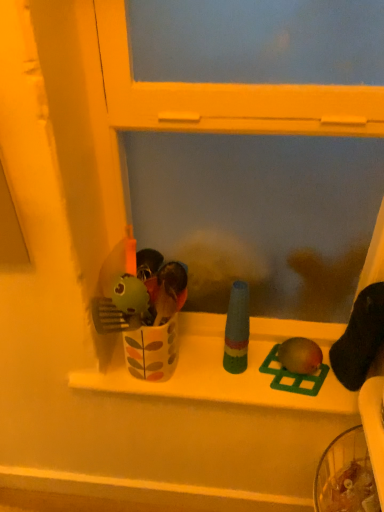
Locate an element on the screen. The image size is (384, 512). multicolored plastic bottle at center, the first toy from the left is located at coordinates (237, 329).

Where is `matte green toy at center, which ranks as the 3th toy in left-to-right order`? matte green toy at center, which ranks as the 3th toy in left-to-right order is located at coordinates (300, 356).

The image size is (384, 512). I want to click on green plastic bird at center, which is counted as the 2th toy, starting from the right, so click(292, 376).

Measure the distance between point (305, 384) and camera.

3.28 feet.

Image resolution: width=384 pixels, height=512 pixels. Find the location of `multicolored plastic bottle at center, the 3th toy when ordered from right to left`. multicolored plastic bottle at center, the 3th toy when ordered from right to left is located at coordinates (237, 329).

From a real-world perspective, between green plastic bird at center, which is counted as the 2th toy, starting from the right, and multicolored plastic bottle at center, the 3th toy when ordered from right to left, who is vertically lower?

green plastic bird at center, which is counted as the 2th toy, starting from the right.

Does point (300, 383) come closer to viewer compared to point (233, 304)?

No, (300, 383) is further to viewer.

From the image's perspective, starting from the multicolored plastic bottle at center, the first toy from the left, which toy is the 2nd one below? Please provide its 2D coordinates.

[(292, 376)]

Considering the sizes of objects green plastic bird at center, which is counted as the 2th toy, starting from the right, and multicolored plastic bottle at center, the first toy from the left, in the image provided, who is bigger, green plastic bird at center, which is counted as the 2th toy, starting from the right, or multicolored plastic bottle at center, the first toy from the left,?

With larger size is multicolored plastic bottle at center, the first toy from the left.

From the picture: From the image's perspective, is white glossy window sill at center over multicolored plastic bottle at center, the first toy from the left?

No, from the image's perspective, white glossy window sill at center is not on top of multicolored plastic bottle at center, the first toy from the left.

Is white glossy window sill at center wider than multicolored plastic bottle at center, the first toy from the left?

Yes, white glossy window sill at center is wider than multicolored plastic bottle at center, the first toy from the left.

Could you tell me if white glossy window sill at center is facing multicolored plastic bottle at center, the 3th toy when ordered from right to left?

No, white glossy window sill at center is not turned towards multicolored plastic bottle at center, the 3th toy when ordered from right to left.

Considering the points (187, 382) and (248, 325), which point is behind, point (187, 382) or point (248, 325)?

Point (248, 325)

Is green plastic bird at center, which is counted as the 2th toy, starting from the left, located within matte green toy at center, which is counted as the first toy, starting from the right?

No, green plastic bird at center, which is counted as the 2th toy, starting from the left, is located outside of matte green toy at center, which is counted as the first toy, starting from the right.

Measure the distance between matte green toy at center, which is counted as the first toy, starting from the right, and green plastic bird at center, which is counted as the 2th toy, starting from the left.

matte green toy at center, which is counted as the first toy, starting from the right, and green plastic bird at center, which is counted as the 2th toy, starting from the left, are 1.21 inches apart.

Between matte green toy at center, which ranks as the 3th toy in left-to-right order, and green plastic bird at center, which is counted as the 2th toy, starting from the right, which one has smaller size?

green plastic bird at center, which is counted as the 2th toy, starting from the right, is smaller.

Considering the relative positions of matte green toy at center, which is counted as the first toy, starting from the right, and green plastic bird at center, which is counted as the 2th toy, starting from the right, in the image provided, is matte green toy at center, which is counted as the first toy, starting from the right, to the right of green plastic bird at center, which is counted as the 2th toy, starting from the right, from the viewer's perspective?

Yes.

Find the location of a particular element. The width and height of the screenshot is (384, 512). the 1st toy positioned above the white glossy window sill at center (from a real-world perspective) is located at coordinates (292, 376).

Who is taller, white glossy window sill at center or green plastic bird at center, which is counted as the 2th toy, starting from the left?

Standing taller between the two is white glossy window sill at center.

Which is in front, point (188, 322) or point (270, 374)?

Point (270, 374)

Considering the sizes of objects white glossy window sill at center and green plastic bird at center, which is counted as the 2th toy, starting from the left, in the image provided, who is wider, white glossy window sill at center or green plastic bird at center, which is counted as the 2th toy, starting from the left,?

white glossy window sill at center is wider.

Does point (97, 387) appear closer or farther from the camera than point (302, 352)?

Point (97, 387).

Looking at this image, does white glossy window sill at center contain matte green toy at center, which is counted as the first toy, starting from the right?

Definitely not — matte green toy at center, which is counted as the first toy, starting from the right, is not inside white glossy window sill at center.

Is white glossy window sill at center oriented away from matte green toy at center, which is counted as the first toy, starting from the right?

No, white glossy window sill at center is not facing away from matte green toy at center, which is counted as the first toy, starting from the right.

Does point (234, 308) come behind point (298, 392)?

That is False.

Is multicolored plastic bottle at center, the first toy from the left, oriented towards green plastic bird at center, which is counted as the 2th toy, starting from the right?

No, multicolored plastic bottle at center, the first toy from the left, is not oriented towards green plastic bird at center, which is counted as the 2th toy, starting from the right.

Is green plastic bird at center, which is counted as the 2th toy, starting from the right, inside multicolored plastic bottle at center, the first toy from the left?

No, green plastic bird at center, which is counted as the 2th toy, starting from the right, is located outside of multicolored plastic bottle at center, the first toy from the left.

Is the surface of multicolored plastic bottle at center, the 3th toy when ordered from right to left, in direct contact with green plastic bird at center, which is counted as the 2th toy, starting from the left?

There is a gap between multicolored plastic bottle at center, the 3th toy when ordered from right to left, and green plastic bird at center, which is counted as the 2th toy, starting from the left.

Considering the sizes of objects green plastic bird at center, which is counted as the 2th toy, starting from the right, and matte green toy at center, which ranks as the 3th toy in left-to-right order, in the image provided, who is bigger, green plastic bird at center, which is counted as the 2th toy, starting from the right, or matte green toy at center, which ranks as the 3th toy in left-to-right order,?

With larger size is matte green toy at center, which ranks as the 3th toy in left-to-right order.

In terms of width, does green plastic bird at center, which is counted as the 2th toy, starting from the right, look wider or thinner when compared to matte green toy at center, which ranks as the 3th toy in left-to-right order?

Considering their sizes, green plastic bird at center, which is counted as the 2th toy, starting from the right, looks broader than matte green toy at center, which ranks as the 3th toy in left-to-right order.

In the scene shown: Is the position of green plastic bird at center, which is counted as the 2th toy, starting from the left, less distant than that of matte green toy at center, which is counted as the first toy, starting from the right?

That is False.

This screenshot has height=512, width=384. In order to click on toy that is the 2nd one when counting upward from the green plastic bird at center, which is counted as the 2th toy, starting from the right (from the image's perspective) in this screenshot , I will do `click(237, 329)`.

The width and height of the screenshot is (384, 512). I want to click on toy that is the 1st one when counting rightward from the white glossy window sill at center, so click(237, 329).

From the image, which object appears to be farther from multicolored plastic bottle at center, the 3th toy when ordered from right to left, matte green toy at center, which ranks as the 3th toy in left-to-right order, or white glossy window sill at center?

The object further to multicolored plastic bottle at center, the 3th toy when ordered from right to left, is matte green toy at center, which ranks as the 3th toy in left-to-right order.

From the image, which object appears to be nearer to multicolored plastic bottle at center, the 3th toy when ordered from right to left, green plastic bird at center, which is counted as the 2th toy, starting from the right, or matte green toy at center, which is counted as the first toy, starting from the right?

green plastic bird at center, which is counted as the 2th toy, starting from the right, is positioned closer to the anchor multicolored plastic bottle at center, the 3th toy when ordered from right to left.

Which object lies further to the anchor point green plastic bird at center, which is counted as the 2th toy, starting from the right, matte green toy at center, which is counted as the first toy, starting from the right, or white glossy window sill at center?

→ white glossy window sill at center is further to green plastic bird at center, which is counted as the 2th toy, starting from the right.

Based on their spatial positions, is white glossy window sill at center or green plastic bird at center, which is counted as the 2th toy, starting from the left, closer to multicolored plastic bottle at center, the 3th toy when ordered from right to left?

green plastic bird at center, which is counted as the 2th toy, starting from the left, is closer to multicolored plastic bottle at center, the 3th toy when ordered from right to left.

Looking at this image, based on their spatial positions, is matte green toy at center, which is counted as the first toy, starting from the right, or multicolored plastic bottle at center, the 3th toy when ordered from right to left, further from white glossy window sill at center?

matte green toy at center, which is counted as the first toy, starting from the right, is positioned further to the anchor white glossy window sill at center.

Looking at the image, which one is located closer to white glossy window sill at center, green plastic bird at center, which is counted as the 2th toy, starting from the left, or matte green toy at center, which is counted as the first toy, starting from the right?

green plastic bird at center, which is counted as the 2th toy, starting from the left, is closer to white glossy window sill at center.

Which object lies further to the anchor point matte green toy at center, which is counted as the first toy, starting from the right, multicolored plastic bottle at center, the 3th toy when ordered from right to left, or green plastic bird at center, which is counted as the 2th toy, starting from the left?

The object further to matte green toy at center, which is counted as the first toy, starting from the right, is multicolored plastic bottle at center, the 3th toy when ordered from right to left.

Looking at the image, which one is located closer to matte green toy at center, which ranks as the 3th toy in left-to-right order, white glossy window sill at center or green plastic bird at center, which is counted as the 2th toy, starting from the left?

Among the two, green plastic bird at center, which is counted as the 2th toy, starting from the left, is located nearer to matte green toy at center, which ranks as the 3th toy in left-to-right order.

At what (x,y) coordinates should I click in order to perform the action: click on toy between multicolored plastic bottle at center, the first toy from the left, and matte green toy at center, which ranks as the 3th toy in left-to-right order, from left to right. Please return your answer as a coordinate pair (x, y). This screenshot has height=512, width=384. Looking at the image, I should click on (292, 376).

At what (x,y) coordinates should I click in order to perform the action: click on toy between white glossy window sill at center and green plastic bird at center, which is counted as the 2th toy, starting from the left. Please return your answer as a coordinate pair (x, y). Looking at the image, I should click on pyautogui.click(x=237, y=329).